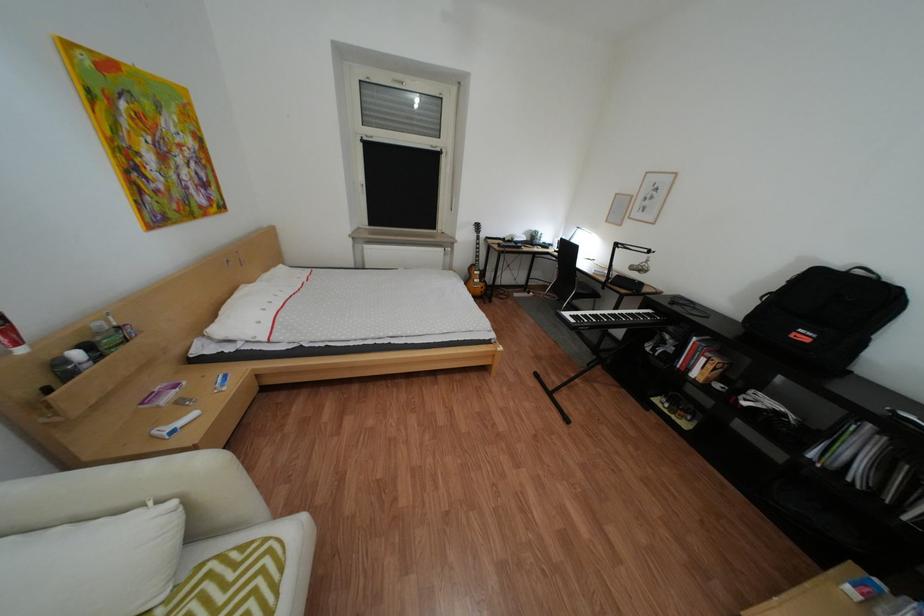
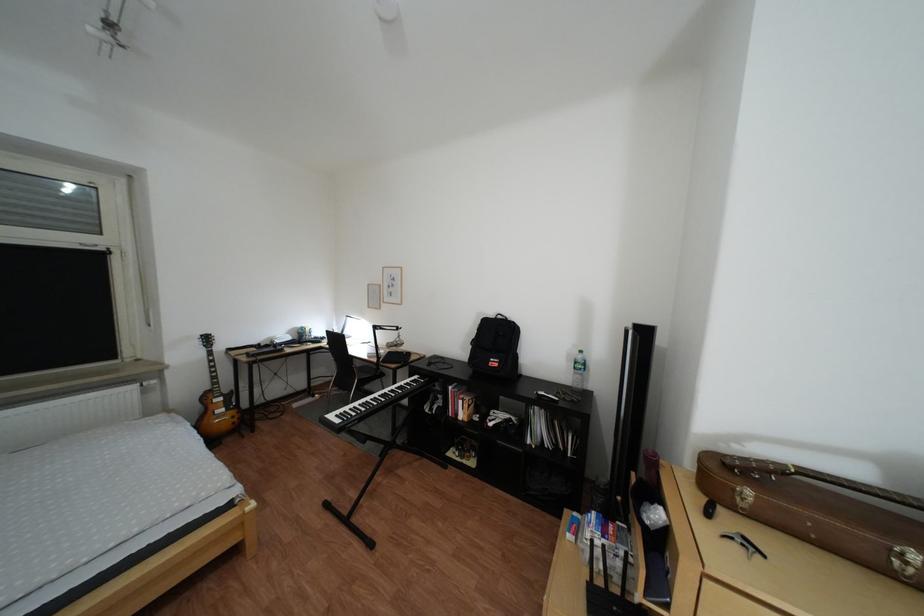
Where in the second image is the point corresponding to point 820,337 from the first image?

(509, 363)